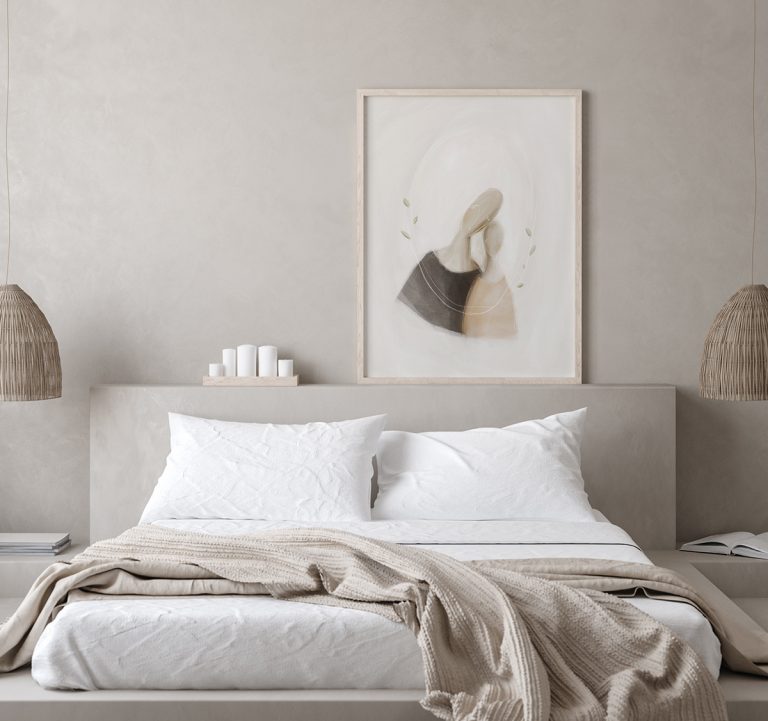
You are a GUI agent. You are given a task and a screenshot of the screen. Output one action in this format:
    pyautogui.click(x=<x>, y=<y>)
    Task: Click on the wall art
    This screenshot has height=721, width=768.
    Given the screenshot: What is the action you would take?
    pyautogui.click(x=518, y=259)